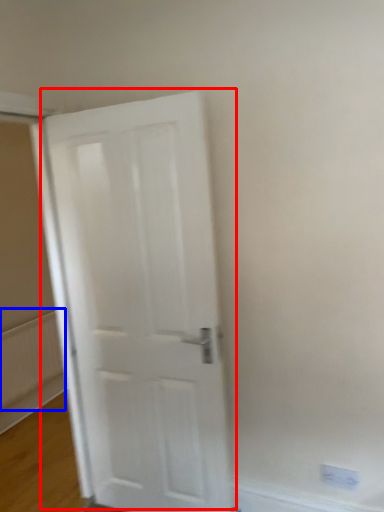
Question: Which object appears farthest to the camera in this image, door (highlighted by a red box) or radiator (highlighted by a blue box)?

Choices:
 (A) door
 (B) radiator

Answer: (B)